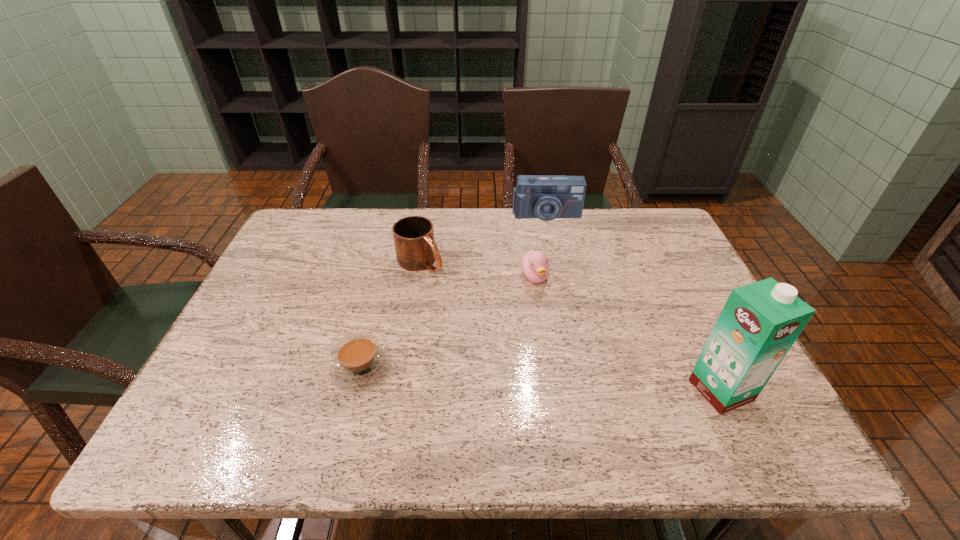
You are a GUI agent. You are given a task and a screenshot of the screen. Output one action in this format:
    pyautogui.click(x=<x>, y=<y>)
    Task: Click on the unoccupied area between the cappuccino and the carton
    Image resolution: width=960 pixels, height=540 pixels.
    Given the screenshot: What is the action you would take?
    pyautogui.click(x=541, y=379)

Locate an element on the screen. The image size is (960, 540). vacant area that lies between the cappuccino and the farthest object is located at coordinates (454, 292).

At what (x,y) coordinates should I click in order to perform the action: click on vacant space that is in between the mug and the duckling. Please return your answer as a coordinate pair (x, y). The height and width of the screenshot is (540, 960). Looking at the image, I should click on (478, 270).

In order to click on vacant point located between the carton and the second shortest object in this screenshot , I will do (x=628, y=334).

Locate an element on the screen. free area in between the carton and the camera is located at coordinates (634, 302).

Find the location of a particular element. The width and height of the screenshot is (960, 540). free point between the rightmost object and the cappuccino is located at coordinates (541, 379).

Find the location of a particular element. The width and height of the screenshot is (960, 540). free space between the mug and the tallest object is located at coordinates point(570,326).

This screenshot has height=540, width=960. Find the location of `empty space between the mug and the carton`. empty space between the mug and the carton is located at coordinates (570, 326).

The image size is (960, 540). I want to click on empty space that is in between the second tallest object and the tallest object, so click(x=634, y=302).

Where is `vacant space that's between the fourth tallest object and the farthest object`? Image resolution: width=960 pixels, height=540 pixels. vacant space that's between the fourth tallest object and the farthest object is located at coordinates (540, 246).